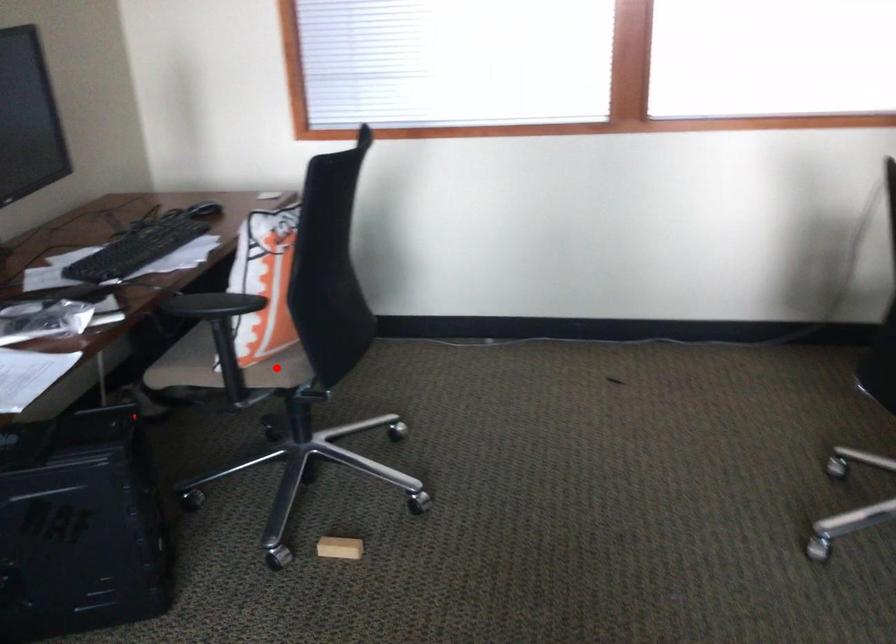
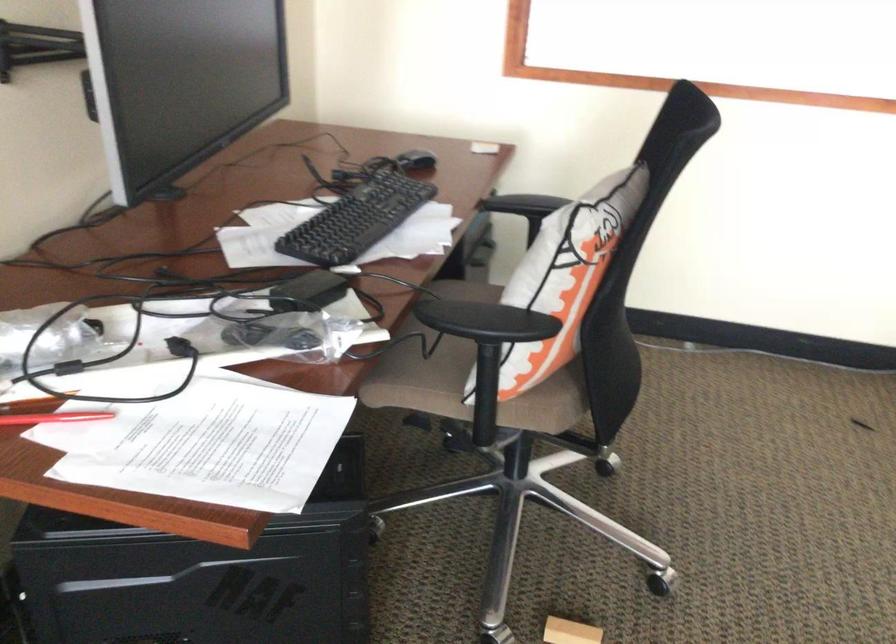
Question: A red point is marked in image1. In image2, is the corresponding 3D point closer to the camera or farther? Reply with the corresponding letter.

Choices:
 (A) The corresponding 3D point is closer.
 (B) The corresponding 3D point is farther.

Answer: (A)